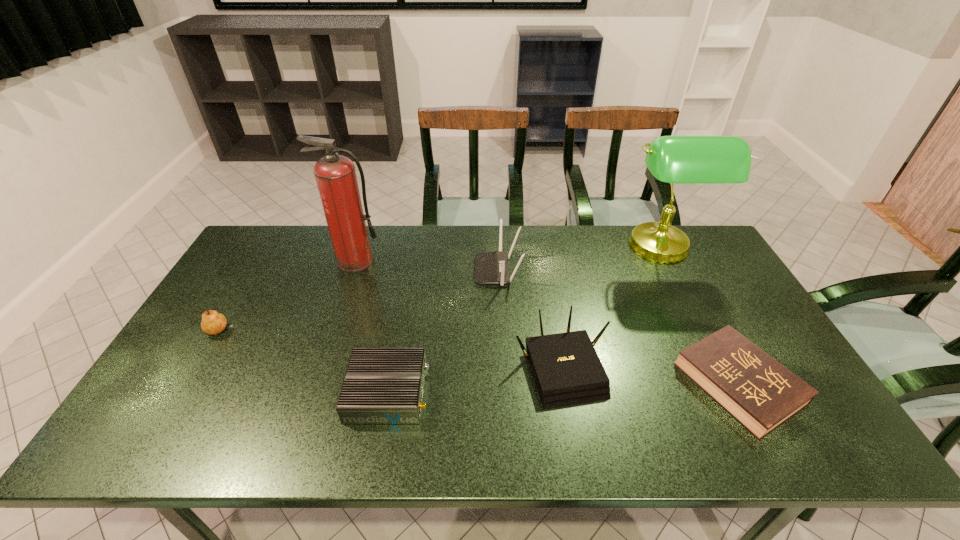
I want to click on vacant region that satisfies the following two spatial constraints: 1. on the desk next to the lamp; 2. on the front side of the fourth shortest object, so click(720, 368).

Image resolution: width=960 pixels, height=540 pixels. Identify the location of free space that satisfies the following two spatial constraints: 1. on the front-facing side of the shortest object; 2. on the left side of the fifth shortest object. (503, 384).

Identify the location of vacant space that satisfies the following two spatial constraints: 1. on the front-facing side of the tallest router; 2. on the back side of the hardback book. (503, 384).